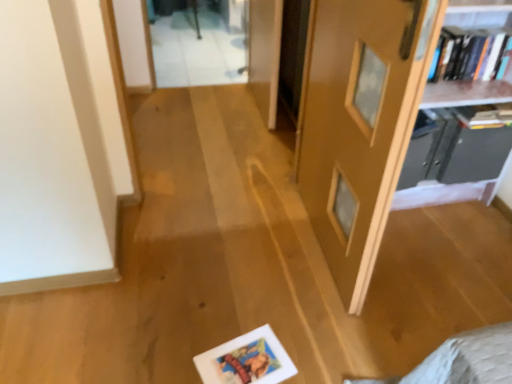
The height and width of the screenshot is (384, 512). In order to click on free space to the right of white matte picture frame at lower center in this screenshot , I will do `click(311, 349)`.